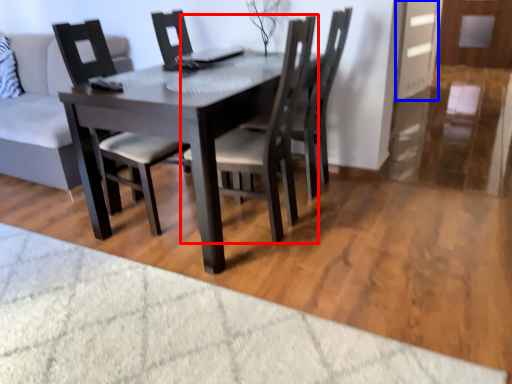
Question: Which point is further to the camera, chair (highlighted by a red box) or glass door (highlighted by a blue box)?

Choices:
 (A) chair
 (B) glass door

Answer: (B)